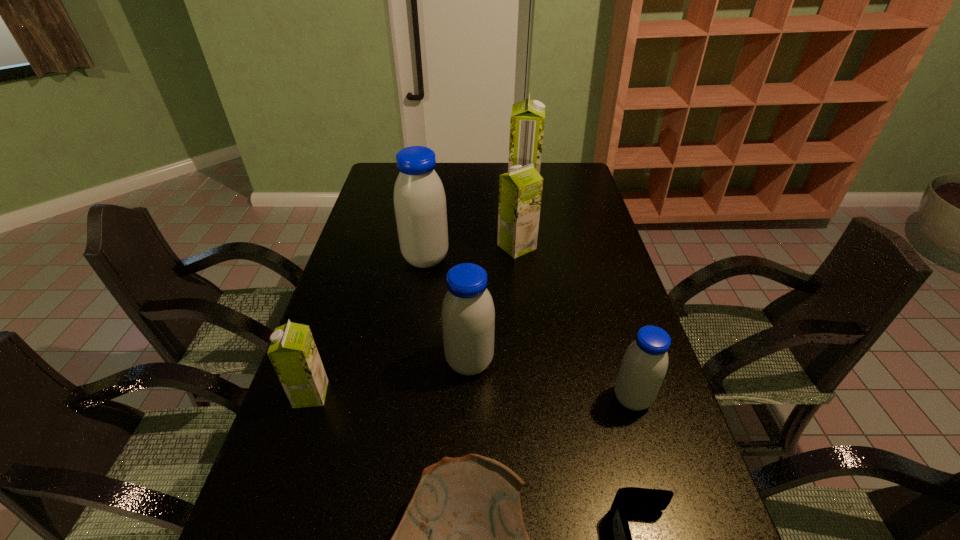
This screenshot has width=960, height=540. I want to click on the rightmost soya milk, so click(644, 365).

What are the coordinates of `vacant space located on the front of the farthest object` in the screenshot? It's located at (526, 213).

Where is `free space located on the back of the biggest blue soya milk`? Image resolution: width=960 pixels, height=540 pixels. free space located on the back of the biggest blue soya milk is located at coordinates (434, 206).

Identify the location of vacant space positioned 0.180m on the left of the second biggest green soya milk. [445, 247].

I want to click on vacant space located on the right of the second blue soya milk from left to right, so click(x=579, y=362).

The image size is (960, 540). I want to click on vacant space located 0.260m on the right of the leftmost object, so click(x=435, y=394).

The image size is (960, 540). In order to click on free region located on the front of the nearest blue soya milk in this screenshot , I will do `click(667, 517)`.

You are a GUI agent. You are given a task and a screenshot of the screen. Output one action in this format:
    pyautogui.click(x=<x>, y=<y>)
    Task: Click on the object present at the far edge
    The height and width of the screenshot is (540, 960).
    Given the screenshot: What is the action you would take?
    pyautogui.click(x=527, y=120)

Where is `object located at the left edge`? object located at the left edge is located at coordinates (293, 353).

The image size is (960, 540). I want to click on object situated at the right edge, so click(x=644, y=365).